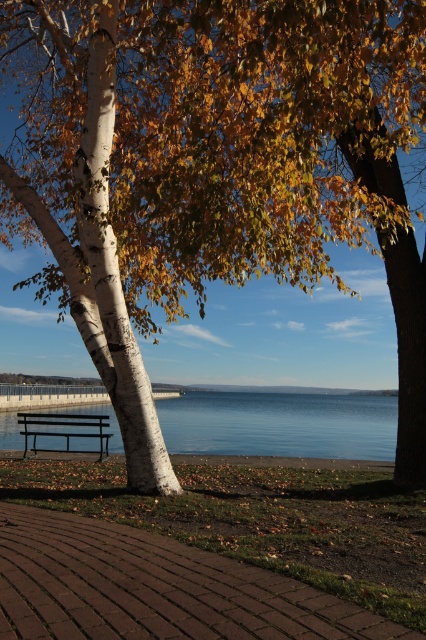
Question: Does brown brick path at lower center appear under clear blue water at center?

Choices:
 (A) no
 (B) yes

Answer: (A)

Question: Based on their relative distances, which object is farther from the white bark birch tree at left?

Choices:
 (A) metallic black bench at center
 (B) clear blue water at center

Answer: (B)

Question: Which point appears farthest from the camera in this image?

Choices:
 (A) [57, 419]
 (B) [354, 419]
 (C) [101, 280]
 (D) [131, 614]

Answer: (B)

Question: Can you confirm if white bark birch tree at left is wider than clear blue water at center?

Choices:
 (A) yes
 (B) no

Answer: (B)

Question: Is brown brick path at lower center to the left of white bark birch tree at left from the viewer's perspective?

Choices:
 (A) no
 (B) yes

Answer: (A)

Question: Which object is the farthest from the clear blue water at center?

Choices:
 (A) brown brick path at lower center
 (B) white bark birch tree at left

Answer: (B)